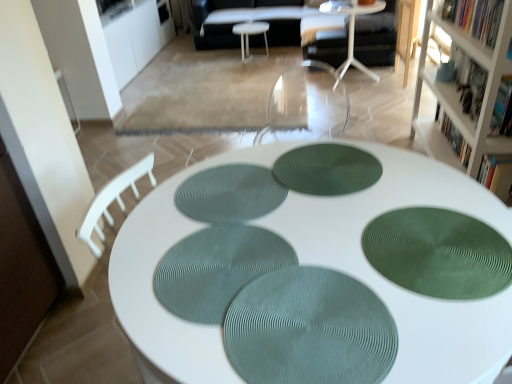
Where is `white fabric couch at center`? This screenshot has height=384, width=512. white fabric couch at center is located at coordinates (245, 21).

Where is `teal textured placemat at center, the third mat viewed from the right`? Image resolution: width=512 pixels, height=384 pixels. teal textured placemat at center, the third mat viewed from the right is located at coordinates (216, 269).

This screenshot has height=384, width=512. What do you see at coordinates (475, 17) in the screenshot? I see `green matte bookshelf at upper right, the 2th book when ordered from back to front` at bounding box center [475, 17].

Image resolution: width=512 pixels, height=384 pixels. I want to click on green textured placemat at center, so click(x=309, y=330).

The image size is (512, 384). Describe the element at coordinates (458, 95) in the screenshot. I see `white wood bookshelf at upper right` at that location.

Locate an element on the screen. white fabric couch at center is located at coordinates (245, 21).

Is green textured mat at lower right, acting as the fourth mat starting from the left, positioned with its back to white plastic table at center, the second table ordered from the bottom?

That's not correct — green textured mat at lower right, acting as the fourth mat starting from the left, is not looking away from white plastic table at center, the second table ordered from the bottom.

Between green textured mat at lower right, marked as the first mat in a right-to-left arrangement, and white plastic table at center, the second table ordered from the bottom, which one is positioned behind?

white plastic table at center, the second table ordered from the bottom, is further away from the camera.

Identify the location of the 4th mat positioned above the white plastic table at center, the 2th table viewed from the back (from a real-world perspective). (438, 253).

Is green textured placemat at center wider or thinner than white plastic table at center, which appears as the first table when viewed from the back?

Considering their sizes, green textured placemat at center looks slimmer than white plastic table at center, which appears as the first table when viewed from the back.

Could you tell me if green textured placemat at center is facing white plastic table at center, which appears as the first table when viewed from the back?

No, green textured placemat at center does not turn towards white plastic table at center, which appears as the first table when viewed from the back.

Considering the positions of point (265, 313) and point (259, 31), is point (265, 313) closer or farther from the camera than point (259, 31)?

Point (265, 313).

Is white plastic table at center, the 2th table viewed from the back, a part of white wood bookshelf at upper right?

No, white wood bookshelf at upper right does not contain white plastic table at center, the 2th table viewed from the back.

Does white wood bookshelf at upper right have a lesser height compared to white plastic table at center, the 2th table viewed from the back?

No, white wood bookshelf at upper right is not shorter than white plastic table at center, the 2th table viewed from the back.

Is white wood bookshelf at upper right far from white plastic table at center, which ranks as the 2th table in front-to-back order?

white wood bookshelf at upper right is positioned a significant distance from white plastic table at center, which ranks as the 2th table in front-to-back order.

From the image's perspective, is white wood bookshelf at upper right positioned above or below white plastic table at center, the 2th table viewed from the back?

From the image's perspective, white wood bookshelf at upper right appears below white plastic table at center, the 2th table viewed from the back.

Does white fabric couch at center contain green textured placemat at center?

No, green textured placemat at center is not a part of white fabric couch at center.

Which is more to the left, white fabric couch at center or green textured placemat at center?

Positioned to the left is white fabric couch at center.

Is white fabric couch at center in front of green textured placemat at center?

No, white fabric couch at center is further to the viewer.

Is point (215, 37) more distant than point (369, 363)?

That is True.

Is teal textured placemat at center, the third mat viewed from the right, oriented towards white textured table at center, the third table positioned from the back?

Yes, teal textured placemat at center, the third mat viewed from the right, is oriented towards white textured table at center, the third table positioned from the back.

Is teal textured placemat at center, the second mat positioned from the left, not within white textured table at center, which is the 1th table from front to back?

No.

Is teal textured placemat at center, the third mat viewed from the right, bigger or smaller than white textured table at center, the third table positioned from the back?

Clearly, teal textured placemat at center, the third mat viewed from the right, is smaller in size than white textured table at center, the third table positioned from the back.

Is teal textured placemat at center, the second mat positioned from the left, placed right next to white textured table at center, marked as the third table in a top-to-bottom arrangement?

No, teal textured placemat at center, the second mat positioned from the left, is not making contact with white textured table at center, marked as the third table in a top-to-bottom arrangement.

Would you consider white plastic table at center, the 2th table viewed from the back, to be distant from teal textured placemat at center, the second mat positioned from the left?

Indeed, white plastic table at center, the 2th table viewed from the back, is not near teal textured placemat at center, the second mat positioned from the left.

Is white plastic table at center, the second table ordered from the bottom, wider than teal textured placemat at center, the third mat viewed from the right?

Yes.

Does white plastic table at center, the 2th table viewed from the back, have a larger size compared to teal textured placemat at center, the second mat positioned from the left?

Correct, white plastic table at center, the 2th table viewed from the back, is larger in size than teal textured placemat at center, the second mat positioned from the left.

Consider the image. Is white plastic table at center, which ranks as the 2th table in front-to-back order, at the left side of teal textured placemat at center, the third mat viewed from the right?

No.

Is hardcover book at upper right, arranged as the third book when viewed from the front, bigger than white wood bookshelf at upper right?

No.

Is hardcover book at upper right, placed as the 1th book when sorted from back to front, touching white wood bookshelf at upper right?

No, hardcover book at upper right, placed as the 1th book when sorted from back to front, is not in contact with white wood bookshelf at upper right.

Consider the image. Is hardcover book at upper right, placed as the 1th book when sorted from back to front, closer to camera compared to white wood bookshelf at upper right?

No, it is not.

Can you tell me how much hardcover book at upper right, arranged as the third book when viewed from the front, and white wood bookshelf at upper right differ in facing direction?

The angle between the facing direction of hardcover book at upper right, arranged as the third book when viewed from the front, and the facing direction of white wood bookshelf at upper right is 7.7e-05 degrees.

This screenshot has width=512, height=384. I want to click on the 1st table positioned above the green textured mat at lower right, marked as the first mat in a right-to-left arrangement (from the image's perspective), so click(352, 34).

The height and width of the screenshot is (384, 512). I want to click on oval that appears on the right of white plastic table at center, the first table when ordered from top to bottom, so click(x=309, y=330).

Considering their positions, is green textured placemat at center, which is the first mat from left to right, positioned further to green matte bookshelf at upper right, the 2th book when ordered from back to front, than green textured mat at lower right, acting as the fourth mat starting from the left?

The object further to green matte bookshelf at upper right, the 2th book when ordered from back to front, is green textured placemat at center, which is the first mat from left to right.

Estimate the real-world distances between objects in this image. Which object is further from white plastic table at center, acting as the 3th table starting from the front, teal textured placemat at center, the third mat viewed from the right, or white wood bookshelf at upper right?

Based on the image, teal textured placemat at center, the third mat viewed from the right, appears to be further to white plastic table at center, acting as the 3th table starting from the front.

Estimate the real-world distances between objects in this image. Which object is further from white textured table at center, which is the 1th table from front to back, white plastic table at center, the first table when ordered from top to bottom, or hardcover book at upper right, placed as the 1th book when sorted from back to front?

white plastic table at center, the first table when ordered from top to bottom, lies further to white textured table at center, which is the 1th table from front to back, than the other object.

When comparing their distances from white fabric couch at center, does green textured mat at lower right, marked as the first mat in a right-to-left arrangement, or white wood bookshelf at upper right seem closer?

Based on the image, white wood bookshelf at upper right appears to be nearer to white fabric couch at center.

Which object lies further to the anchor point green matte bookshelf at upper right, marked as the second book in a front-to-back arrangement, green textured placemat at center, the 2th mat viewed from the right, or green textured placemat at center?

Based on the image, green textured placemat at center appears to be further to green matte bookshelf at upper right, marked as the second book in a front-to-back arrangement.

Consider the image. Estimate the real-world distances between objects in this image. Which object is further from white textured table at center, arranged as the first table when ordered from the bottom, green textured mat at lower right, acting as the fourth mat starting from the left, or green textured placemat at center?

green textured placemat at center is further to white textured table at center, arranged as the first table when ordered from the bottom.

When comparing their distances from green textured placemat at center, the 2th mat viewed from the right, does white fabric couch at center or green matte bookshelf at upper right, marked as the second book in a front-to-back arrangement, seem closer?

green matte bookshelf at upper right, marked as the second book in a front-to-back arrangement, is positioned closer to the anchor green textured placemat at center, the 2th mat viewed from the right.

Looking at the image, which one is located further to white textured table at center, the third table positioned from the back, green textured mat at lower right, marked as the first mat in a right-to-left arrangement, or hardcover book at upper right, arranged as the third book when viewed from the front?

The object further to white textured table at center, the third table positioned from the back, is hardcover book at upper right, arranged as the third book when viewed from the front.

Where is `cabinetry between teal textured placemat at center, the third mat viewed from the right, and hardcover book at upper right, placed as the 1th book when sorted from back to front`? The width and height of the screenshot is (512, 384). cabinetry between teal textured placemat at center, the third mat viewed from the right, and hardcover book at upper right, placed as the 1th book when sorted from back to front is located at coordinates (458, 95).

The image size is (512, 384). I want to click on book between green textured placemat at center and hardcover book at upper right, which is the 3th book in back-to-front order, from left to right, so click(x=475, y=17).

Where is `oval between white textured table at center, arranged as the first table when ordered from the bottom, and hardcover book at upper right, placed as the 1th book when sorted from back to front, along the z-axis`? oval between white textured table at center, arranged as the first table when ordered from the bottom, and hardcover book at upper right, placed as the 1th book when sorted from back to front, along the z-axis is located at coordinates (309, 330).

You are a GUI agent. You are given a task and a screenshot of the screen. Output one action in this format:
    pyautogui.click(x=<x>, y=<y>)
    Task: Click on the cabinetry positioned between green textured mat at lower right, marked as the first mat in a right-to-left arrangement, and hardcover book at upper right, which is the 1th book from front to back, from near to far
    This screenshot has width=512, height=384.
    Given the screenshot: What is the action you would take?
    pyautogui.click(x=458, y=95)